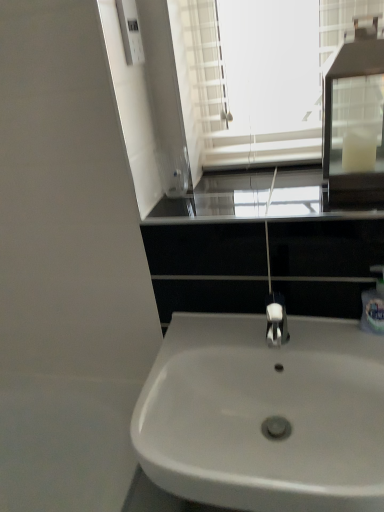
Question: Can we say black glass window sill at center lies outside white plastic soap dispenser at right?

Choices:
 (A) no
 (B) yes

Answer: (B)

Question: Is black glass window sill at center shorter than white plastic soap dispenser at right?

Choices:
 (A) yes
 (B) no

Answer: (A)

Question: From the image's perspective, is black glass window sill at center located beneath white plastic soap dispenser at right?

Choices:
 (A) yes
 (B) no

Answer: (B)

Question: Could you tell me if black glass window sill at center is turned towards white plastic soap dispenser at right?

Choices:
 (A) no
 (B) yes

Answer: (A)

Question: Does black glass window sill at center have a greater width compared to white plastic soap dispenser at right?

Choices:
 (A) yes
 (B) no

Answer: (A)

Question: Is point (367, 307) positioned closer to the camera than point (264, 371)?

Choices:
 (A) farther
 (B) closer

Answer: (B)

Question: From the image's perspective, relative to white glossy sink at center, is white plastic soap dispenser at right above or below?

Choices:
 (A) above
 (B) below

Answer: (A)

Question: From a real-world perspective, is white plastic soap dispenser at right above or below white glossy sink at center?

Choices:
 (A) below
 (B) above

Answer: (B)

Question: Would you say white plastic soap dispenser at right is to the left or to the right of white glossy sink at center in the picture?

Choices:
 (A) right
 (B) left

Answer: (A)

Question: Considering their positions, is white glass medicine cabinet at upper right located in front of or behind white glossy sink at center?

Choices:
 (A) behind
 (B) front

Answer: (A)

Question: Choose the correct answer: Is white glass medicine cabinet at upper right inside white glossy sink at center or outside it?

Choices:
 (A) inside
 (B) outside

Answer: (B)

Question: Is white glass medicine cabinet at upper right taller or shorter than white glossy sink at center?

Choices:
 (A) short
 (B) tall

Answer: (B)

Question: Is white glass medicine cabinet at upper right wider or thinner than white glossy sink at center?

Choices:
 (A) wide
 (B) thin

Answer: (B)

Question: Considering their positions, is black glass window sill at center located in front of or behind white plastic soap dispenser at right?

Choices:
 (A) front
 (B) behind

Answer: (A)

Question: Based on their positions, is black glass window sill at center located to the left or right of white plastic soap dispenser at right?

Choices:
 (A) right
 (B) left

Answer: (B)